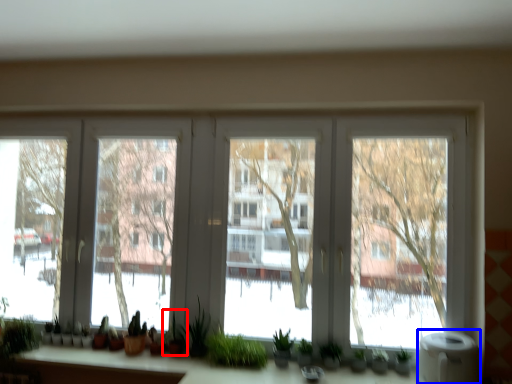
Question: Which object is further to the camera taking this photo, plant (highlighted by a red box) or water heater (highlighted by a blue box)?

Choices:
 (A) plant
 (B) water heater

Answer: (A)